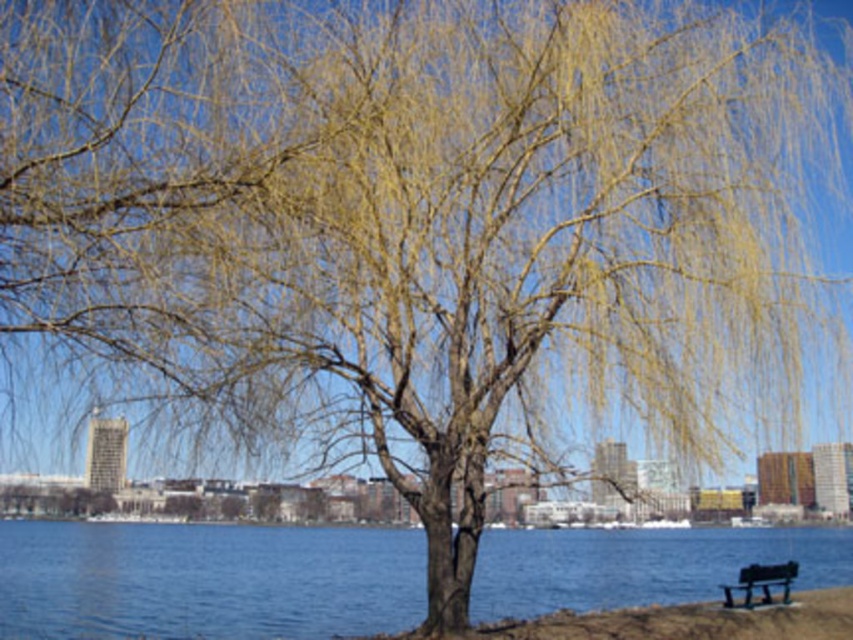
You are a tourist visiting the riverside and want to sit on the green painted wood bench at lower right. From your current position at the blue water at center, which direction should you walk to reach the bench?

The blue water at center is positioned on the left side of the green painted wood bench at lower right. Therefore, you should walk to the right to reach the green painted wood bench at lower right from the blue water at center.